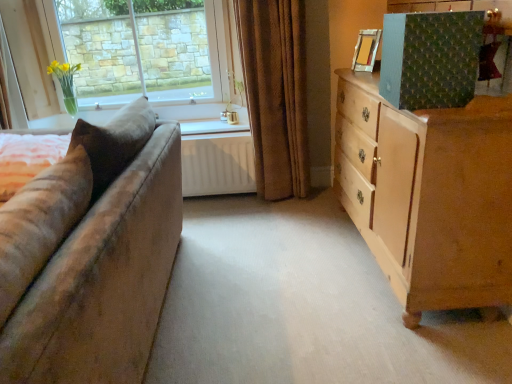
I want to click on vacant area that lies between light brown wooden chest of drawers at right and brown velvet curtain at center, so (316, 235).